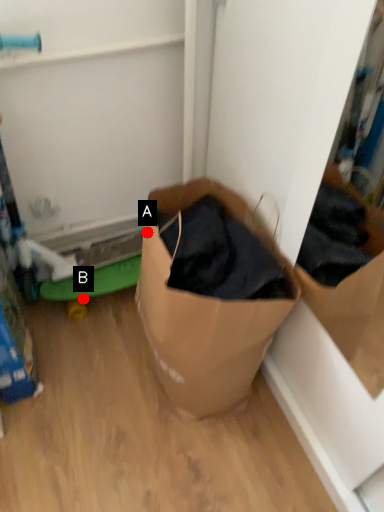
Question: Two points are circled on the image, labeled by A and B beside each circle. Among these points, which one is farthest from the camera?

Choices:
 (A) A is further
 (B) B is further

Answer: (B)